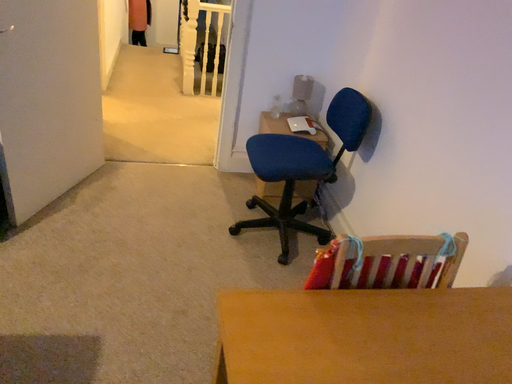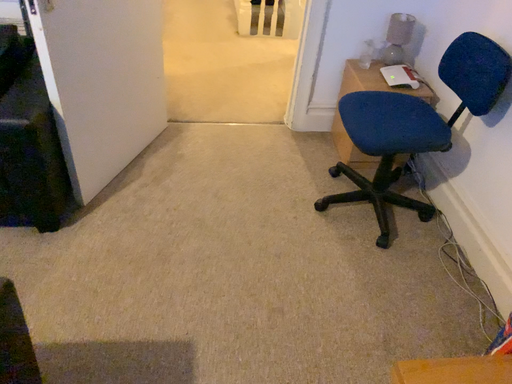
Question: How did the camera likely rotate when shooting the video?

Choices:
 (A) rotated upward
 (B) rotated downward

Answer: (B)